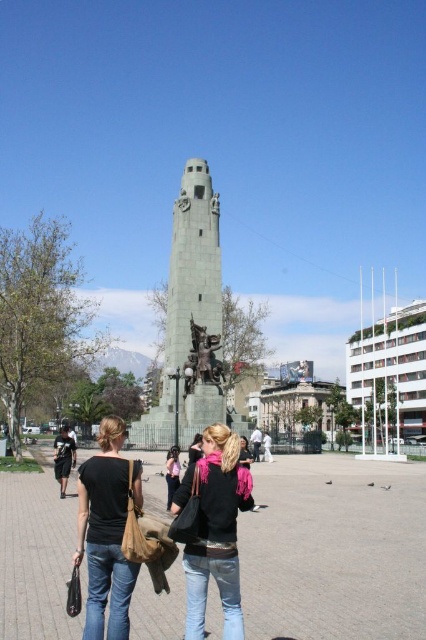
From the picture: How far apart are bronze statue at center and matte black jacket at center?

bronze statue at center is 37.49 feet away from matte black jacket at center.

Describe the element at coordinates (203, 356) in the screenshot. The height and width of the screenshot is (640, 426). I see `bronze statue at center` at that location.

Where is `bronze statue at center`? bronze statue at center is located at coordinates (203, 356).

Is bronze statue at center to the right of pink fabric scarf at center from the viewer's perspective?

In fact, bronze statue at center is to the left of pink fabric scarf at center.

Who is taller, bronze statue at center or pink fabric scarf at center?

pink fabric scarf at center

Which is behind, point (190, 330) or point (253, 509)?

Point (190, 330)

You are a GUI agent. You are given a task and a screenshot of the screen. Output one action in this format:
    pyautogui.click(x=<x>, y=<y>)
    Task: Click on the bronze statue at center
    
    Given the screenshot: What is the action you would take?
    pyautogui.click(x=203, y=356)

Does point (120, 524) come closer to viewer compared to point (178, 464)?

Yes, it is.

Does black matte shirt at center have a greater width compared to matte black jacket at center?

Yes, black matte shirt at center is wider than matte black jacket at center.

The height and width of the screenshot is (640, 426). Describe the element at coordinates (106, 532) in the screenshot. I see `black matte shirt at center` at that location.

Where is `black matte shirt at center`? The width and height of the screenshot is (426, 640). black matte shirt at center is located at coordinates (106, 532).